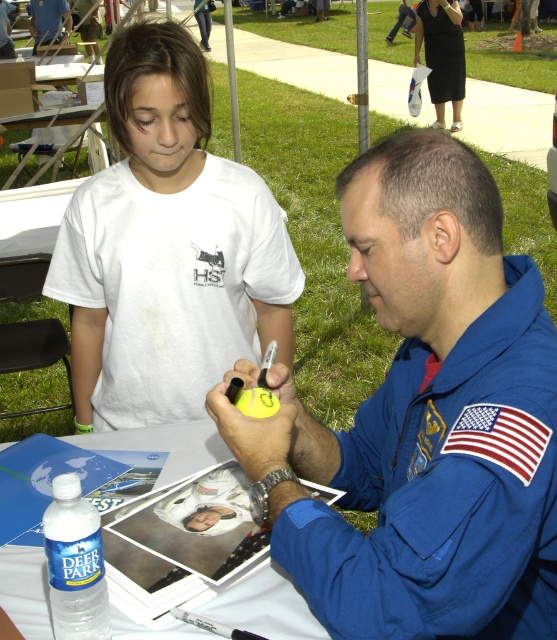
You are attending a space exploration event and notice two items in the scene. The first is a white paper at center, and the second is a blue space suit at center. From your perspective, which item is closer to you?

The white paper at center is closer to you because it is in front of the blue space suit at center.

You are standing at the event and want to take a photo of both the white cotton shirt at upper left and the blue space suit at center. Which object should you focus on first to ensure both are in the frame?

You should focus on the white cotton shirt at upper left first because it is closer to the viewer than the blue space suit at center, ensuring both are in the frame.